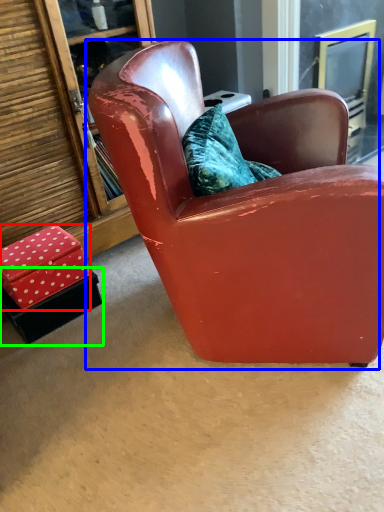
Question: Which is nearer to the box (highlighted by a red box)? chair (highlighted by a blue box) or box (highlighted by a green box).

Choices:
 (A) chair
 (B) box

Answer: (B)